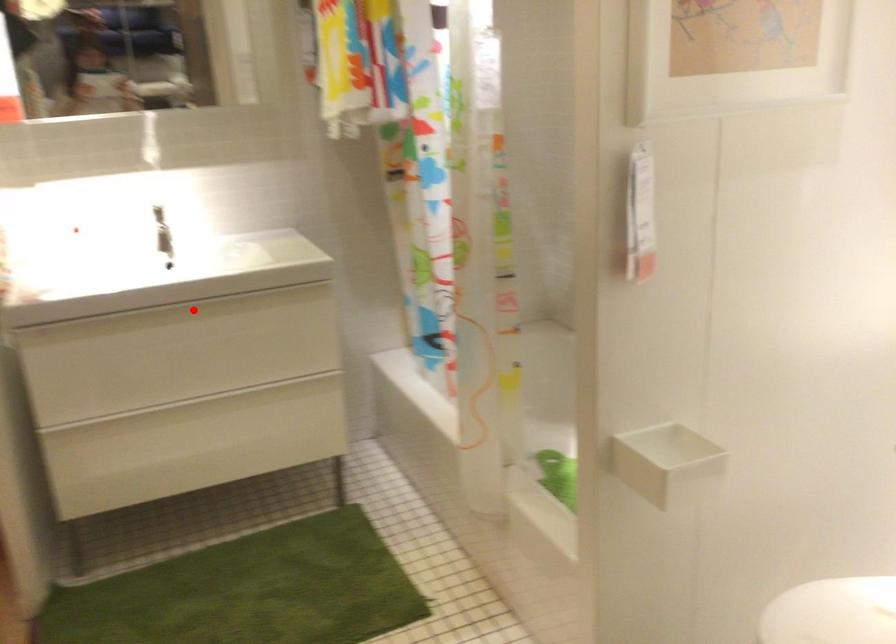
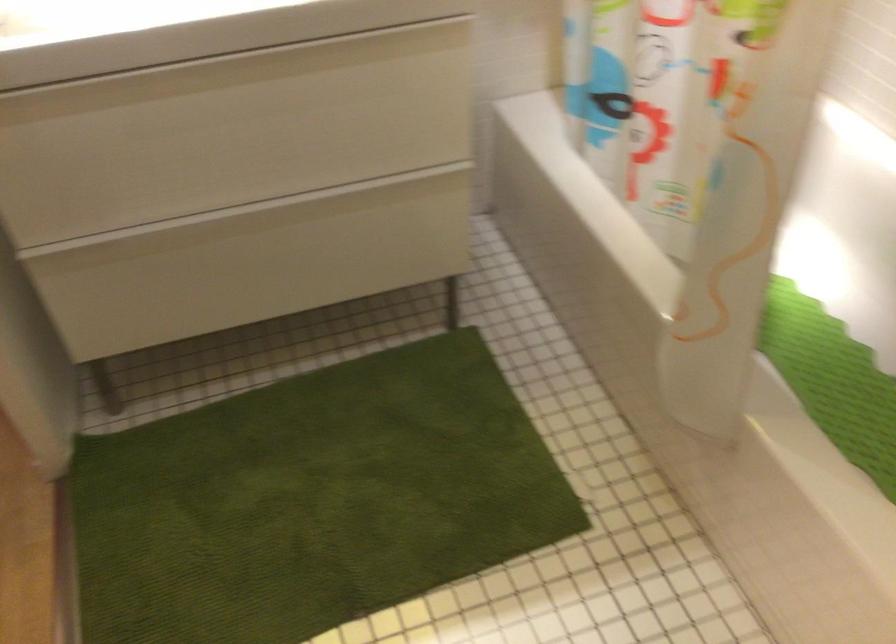
Where in the second image is the point corresponding to the highlighted location from the first image?

(228, 70)